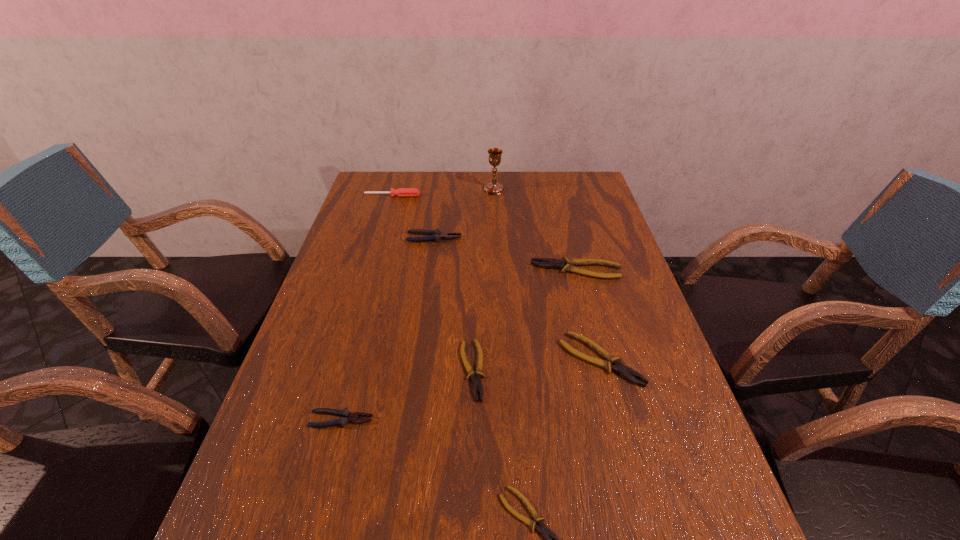
Locate an element on the screen. The image size is (960, 540). the fourth pliers from right to left is located at coordinates (476, 382).

Where is `the third biggest yellow pliers`? the third biggest yellow pliers is located at coordinates (476, 382).

Identify the location of free spot located 0.340m on the front of the tallest object. This screenshot has width=960, height=540. point(497,255).

Locate an element on the screen. The image size is (960, 540). vacant region located on the right of the screwdriver is located at coordinates (446, 196).

Locate an element on the screen. free region located at the gripping part of the farthest pliers is located at coordinates (572, 238).

Where is `vacant point located on the back of the farthest yellow pliers`? This screenshot has width=960, height=540. vacant point located on the back of the farthest yellow pliers is located at coordinates (559, 204).

Locate an element on the screen. free spot located 0.140m on the front of the second biggest yellow pliers is located at coordinates (624, 450).

The image size is (960, 540). What are the coordinates of `vacant area situated 0.380m at the gripping part of the smaller gray pliers` in the screenshot? It's located at (562, 420).

At what (x,y) coordinates should I click in order to perform the action: click on vacant region located on the right of the leftmost yellow pliers. Please return your answer as a coordinate pair (x, y). The height and width of the screenshot is (540, 960). Looking at the image, I should click on (606, 370).

Image resolution: width=960 pixels, height=540 pixels. In order to click on chalice at the far edge in this screenshot , I will do `click(493, 188)`.